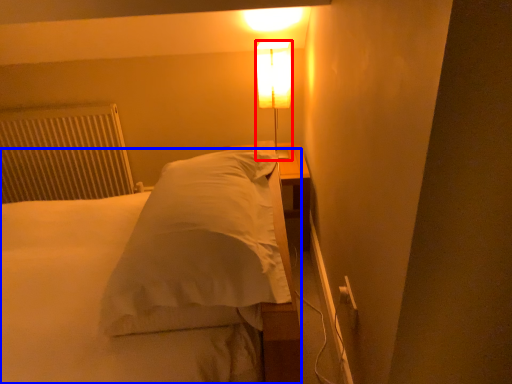
Question: Which object is further to the camera taking this photo, lamp (highlighted by a red box) or bed (highlighted by a blue box)?

Choices:
 (A) lamp
 (B) bed

Answer: (A)